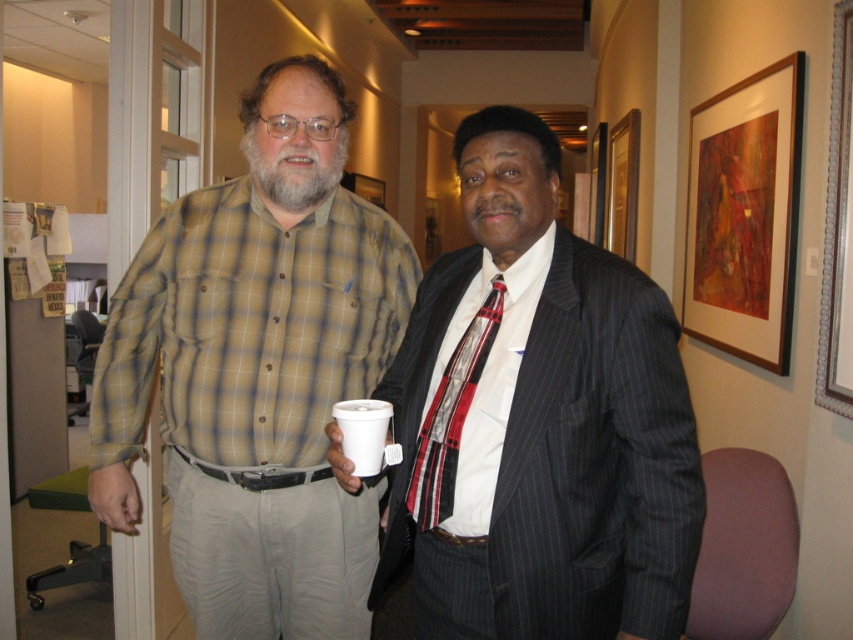
Is wooden picture frame at upper right to the right of white styrofoam cup at center from the viewer's perspective?

Indeed, wooden picture frame at upper right is positioned on the right side of white styrofoam cup at center.

Does wooden picture frame at upper right lie in front of white styrofoam cup at center?

No, wooden picture frame at upper right is further to the viewer.

Who is more forward, [606,176] or [380,440]?

Positioned in front is point [380,440].

Identify the location of wooden picture frame at upper right. (622, 186).

Looking at this image, does plaid shirt at center have a greater height compared to red plaid tie at center?

Result: Correct, plaid shirt at center is much taller as red plaid tie at center.

The image size is (853, 640). Describe the element at coordinates (257, 371) in the screenshot. I see `plaid shirt at center` at that location.

At what (x,y) coordinates should I click in order to perform the action: click on plaid shirt at center. Please return your answer as a coordinate pair (x, y). Image resolution: width=853 pixels, height=640 pixels. Looking at the image, I should click on (257, 371).

Identify the location of plaid shirt at center. (257, 371).

Is striped suit at center to the left of plaid shirt at center from the viewer's perspective?

Incorrect, striped suit at center is not on the left side of plaid shirt at center.

Between striped suit at center and plaid shirt at center, which one appears on the left side from the viewer's perspective?

plaid shirt at center

Is point (645, 362) closer to camera compared to point (363, 221)?

Yes.

Where is `striped suit at center`? The height and width of the screenshot is (640, 853). striped suit at center is located at coordinates (540, 420).